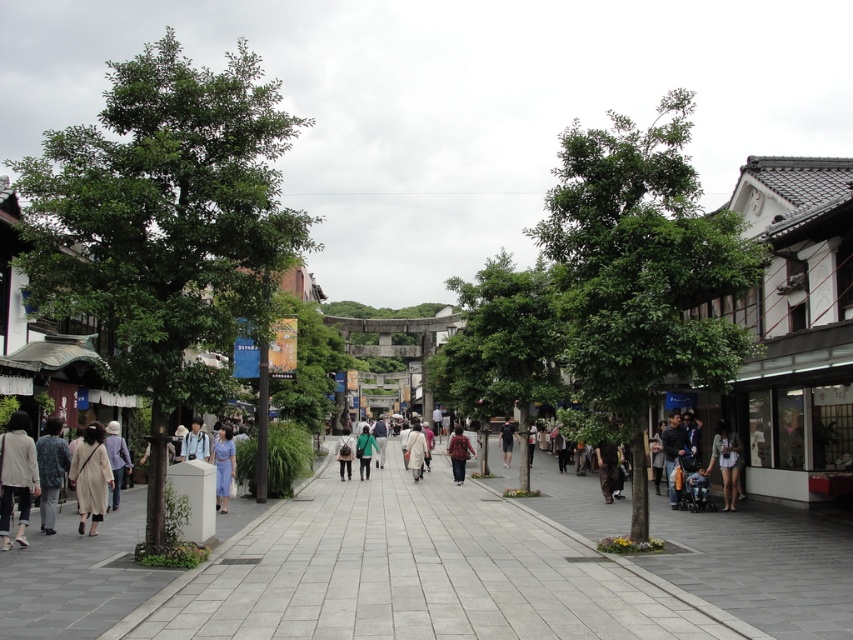
Which is above, plaid fabric shirt at center or white matte coat at center?

plaid fabric shirt at center

Does point (456, 483) come closer to viewer compared to point (422, 458)?

Yes, point (456, 483) is in front of point (422, 458).

From the picture: Who is more distant from viewer, (x=463, y=442) or (x=405, y=445)?

Positioned behind is point (x=405, y=445).

Identify the location of plaid fabric shirt at center. (457, 452).

Locate an element on the screen. This screenshot has height=640, width=853. blue fabric dress at center is located at coordinates (223, 465).

In the scene shown: Which is more to the right, blue fabric dress at center or green matte jacket at center?

From the viewer's perspective, green matte jacket at center appears more on the right side.

Measure the distance between point (216, 490) and camera.

28.59 meters

The height and width of the screenshot is (640, 853). Find the location of `blue fabric dress at center`. blue fabric dress at center is located at coordinates (223, 465).

Does point (3, 506) come closer to viewer compared to point (672, 445)?

Yes, it is in front of point (672, 445).

Which is in front, point (16, 458) or point (663, 449)?

Positioned in front is point (16, 458).

Who is more distant from viewer, (38, 481) or (672, 436)?

The point (672, 436) is more distant.

This screenshot has width=853, height=640. Find the location of `light beige fabric jacket at lower left`. light beige fabric jacket at lower left is located at coordinates (16, 476).